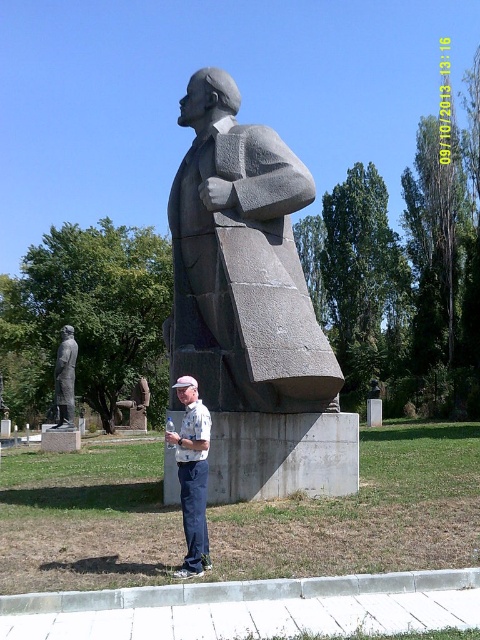
You are a photographer trying to capture the gray stone bust at center and the white cotton shirt at center in a single shot. Which object should you focus on first to ensure both are in focus?

You should focus on the gray stone bust at center first because it is closer to you than the white cotton shirt at center, so focusing on the closer object will help both be in focus.

You are a tourist standing in the park and see the gray stone bust at center and the polished bronze statue at lower left. Which one is positioned more to the right side of the park?

The gray stone bust at center is positioned more to the right side of the park than the polished bronze statue at lower left.

You are a photographer trying to capture the gray stone bust at center and the white cotton shirt at center in a single photo. Based on their positions, which object should appear higher in the photo?

The gray stone bust at center is located above the white cotton shirt at center, so it will appear higher in the photo.